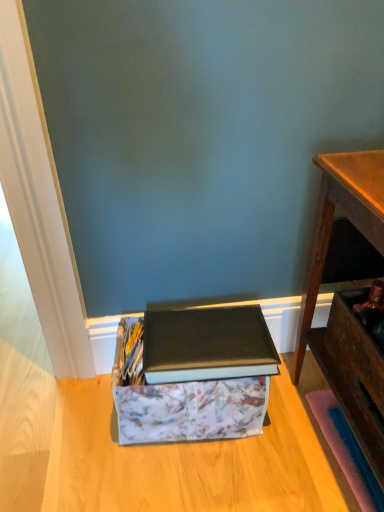
Image resolution: width=384 pixels, height=512 pixels. Identify the location of vacant space to the right of floral fabric storage box at lower center. (293, 422).